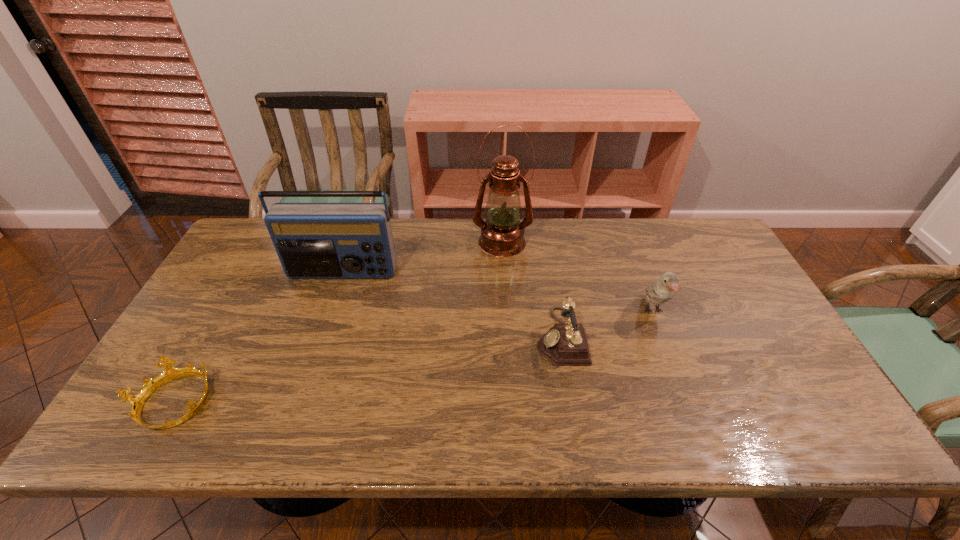
Image resolution: width=960 pixels, height=540 pixels. I want to click on free space located 0.320m on the front panel of the second farthest object, so click(x=309, y=373).

Find the location of `vacant area situated 0.270m at the face of the bird`. vacant area situated 0.270m at the face of the bird is located at coordinates (696, 423).

At what (x,y) coordinates should I click in order to perform the action: click on free space located 0.080m on the dial of the second shortest object. Please return your answer as a coordinate pair (x, y). Image resolution: width=960 pixels, height=540 pixels. Looking at the image, I should click on (506, 336).

Identify the location of vacant space located on the dial of the second shortest object. (510, 336).

At what (x,y) coordinates should I click in order to perform the action: click on free space located 0.230m on the dial of the second shortest object. Please return your answer as a coordinate pair (x, y). The image size is (960, 540). Looking at the image, I should click on (449, 336).

The height and width of the screenshot is (540, 960). I want to click on free space located 0.380m on the right of the crown, so click(374, 403).

At what (x,y) coordinates should I click in order to perform the action: click on oil lamp that is at the far edge. Please return your answer as a coordinate pair (x, y). Looking at the image, I should click on (502, 235).

This screenshot has height=540, width=960. In order to click on radio receiver at the far edge in this screenshot , I will do `click(313, 240)`.

You are a GUI agent. You are given a task and a screenshot of the screen. Output one action in this format:
    pyautogui.click(x=<x>, y=<y>)
    Task: Click on the object that is at the near edge
    This screenshot has height=540, width=960.
    Given the screenshot: What is the action you would take?
    pyautogui.click(x=137, y=401)

At what (x,y) coordinates should I click in order to perform the action: click on object that is at the left edge. Please return your answer as a coordinate pair (x, y). This screenshot has width=960, height=540. Looking at the image, I should click on (137, 401).